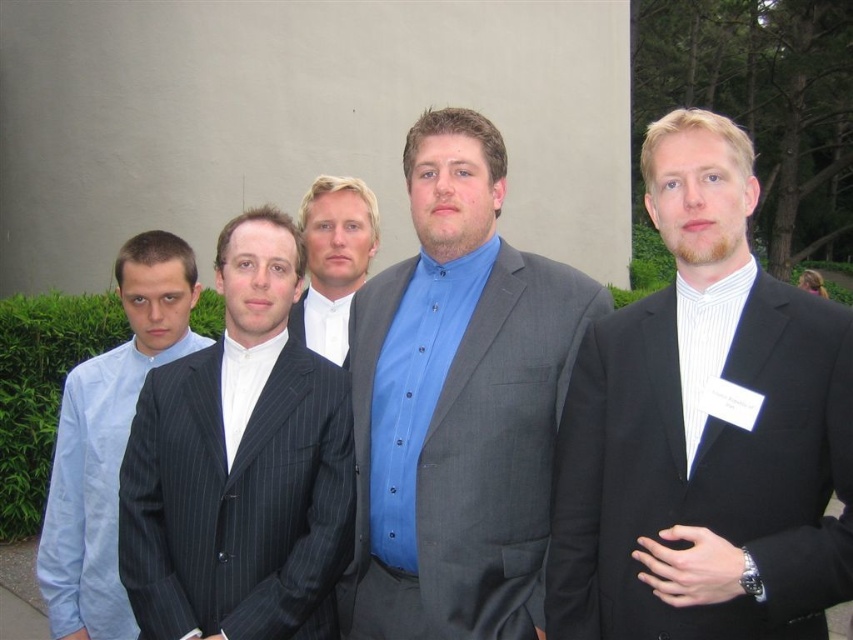
You are a photographer setting up for a group photo. You notice the light blue shirt at left and the white shirt at center. Which shirt has a larger width when viewed from the front?

The light blue shirt at left has a larger width than the white shirt at center.

You are a photographer setting up for a group photo. You need to position two subjects so they are exactly 2 meters apart for the frame. The light blue shirt at left and the white shirt at center are currently positioned in the scene. Can you adjust their positions to meet the required distance?

The light blue shirt at left and white shirt at center are currently 1.79 meters apart. To meet the required 2 meters, they need to move approximately 0.21 meters further apart.

Looking at the group of men in front of the beige wall, where is the matte blue shirt at center in relation to the light blue shirt at left?

The matte blue shirt at center is to the right of the light blue shirt at left.